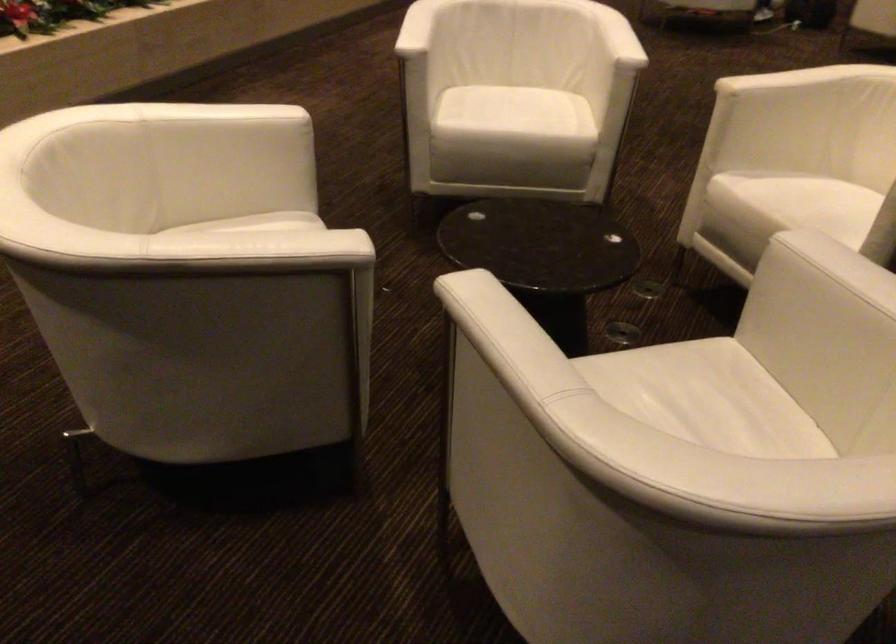
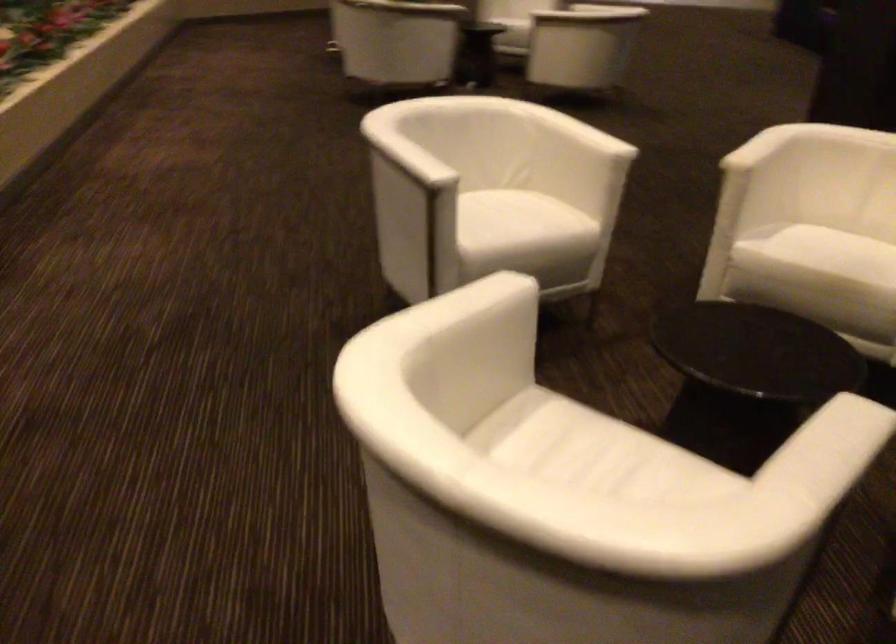
Locate, in the second image, the point that corresponds to (512,102) in the first image.

(502, 214)